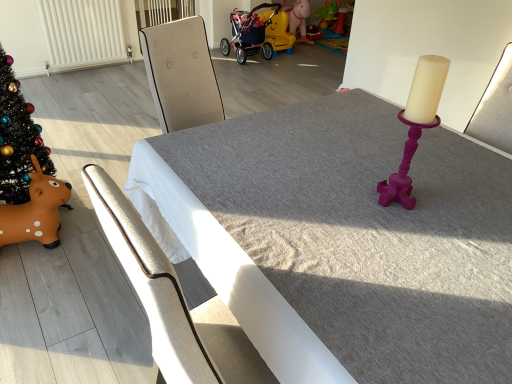
Question: Which direction should I rotate to face rubber yellow horse at center, marked as the 1th toy in a right-to-left arrangement, — up or down?

Choices:
 (A) down
 (B) up

Answer: (B)

Question: Would you consider metallic silver chair at center to be distant from pink fabric baby carriage at upper center?

Choices:
 (A) yes
 (B) no

Answer: (A)

Question: Is metallic silver chair at center thinner than pink fabric baby carriage at upper center?

Choices:
 (A) no
 (B) yes

Answer: (B)

Question: Can you confirm if metallic silver chair at center is positioned to the right of pink fabric baby carriage at upper center?

Choices:
 (A) yes
 (B) no

Answer: (B)

Question: Can you confirm if metallic silver chair at center is shorter than pink fabric baby carriage at upper center?

Choices:
 (A) yes
 (B) no

Answer: (B)

Question: Considering the relative sizes of metallic silver chair at center and pink fabric baby carriage at upper center in the image provided, is metallic silver chair at center smaller than pink fabric baby carriage at upper center?

Choices:
 (A) yes
 (B) no

Answer: (B)

Question: Could pink fabric baby carriage at upper center be considered to be inside metallic silver chair at center?

Choices:
 (A) yes
 (B) no

Answer: (B)

Question: Considering the relative positions of metallic silver chair at center and rubber yellow horse at center, which ranks as the 1th toy in top-to-bottom order, in the image provided, is metallic silver chair at center to the left of rubber yellow horse at center, which ranks as the 1th toy in top-to-bottom order, from the viewer's perspective?

Choices:
 (A) no
 (B) yes

Answer: (B)

Question: Can you confirm if metallic silver chair at center is shorter than rubber yellow horse at center, which is the second toy from left to right?

Choices:
 (A) yes
 (B) no

Answer: (B)

Question: From a real-world perspective, is metallic silver chair at center under rubber yellow horse at center, the first toy viewed from the back?

Choices:
 (A) yes
 (B) no

Answer: (B)

Question: Is the position of metallic silver chair at center more distant than that of rubber yellow horse at center, which is the second toy from left to right?

Choices:
 (A) yes
 (B) no

Answer: (B)

Question: Can you confirm if metallic silver chair at center is positioned to the right of rubber yellow horse at center, the 2th toy when ordered from bottom to top?

Choices:
 (A) yes
 (B) no

Answer: (B)

Question: From the image's perspective, is metallic silver chair at center under rubber yellow horse at center, the 2th toy when ordered from bottom to top?

Choices:
 (A) yes
 (B) no

Answer: (A)

Question: Could shiny black christmas tree at left be considered to be inside smooth gray table at center?

Choices:
 (A) yes
 (B) no

Answer: (B)